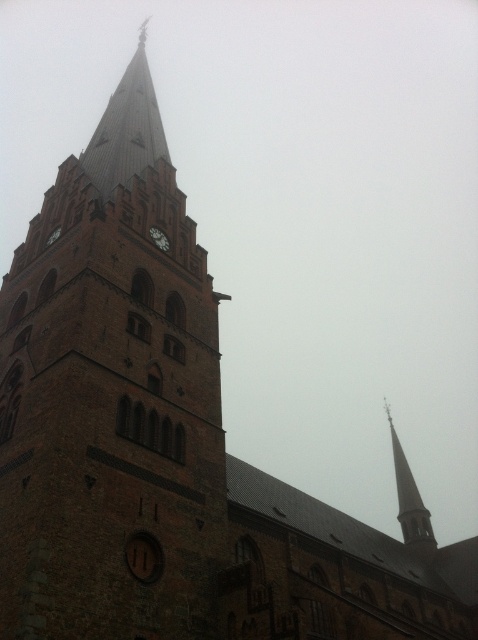
You are standing in front of the historic church and want to take a photo of both the brown brick tower at center and the matte brown clock at center. Since you want the tower to appear larger in the photo than the clock, which object should you focus on first when adjusting your camera settings?

The brown brick tower at center is closer to the viewer than the matte brown clock at center. To make the tower appear larger in the photo, focus on the brown brick tower at center first because objects closer to the camera appear larger.

You are standing in front of the historic church and want to take a photo of the brown brick tower at center and the smooth gray spire at upper right. Which object will appear larger in your photo?

The brown brick tower at center will appear larger in the photo because it is closer to the viewer than the smooth gray spire at upper right.

You are standing in front of the historic church tower and notice two points marked on the tower. The first point is at coordinates point [79,586] and the second is at point [397,486]. Which of these two points is closer to you?

Point [79,586] is closer to the viewer than point [397,486].